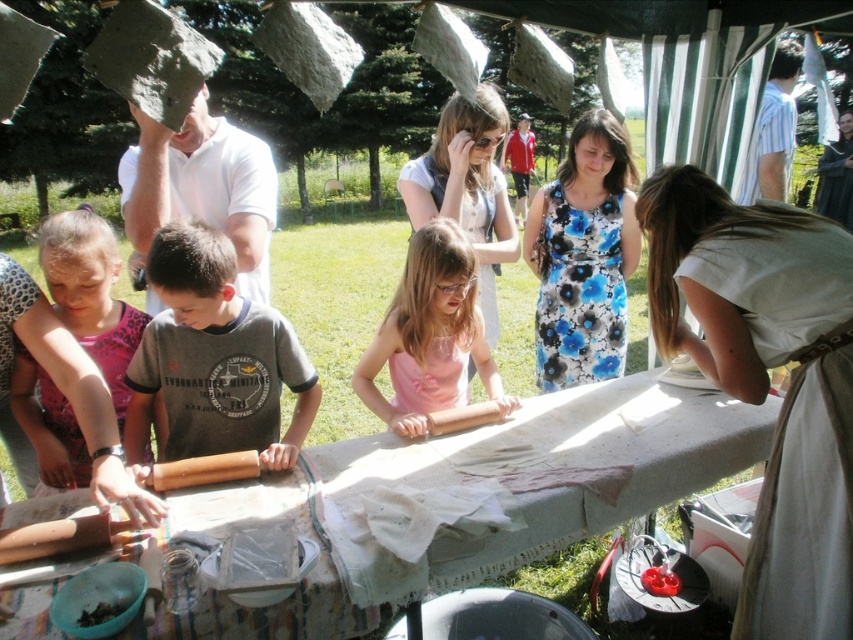
What is the relationship in width between the pink fabric at center and the black matte food at lower left?

The pink fabric at center is wider than the black matte food at lower left.

You are organizing a picnic and need to place the pink floral dress at lower left and the black matte food at lower left on the table. Which item requires more horizontal space on the table?

The pink floral dress at lower left requires more horizontal space on the table because its width is larger than the black matte food at lower left.